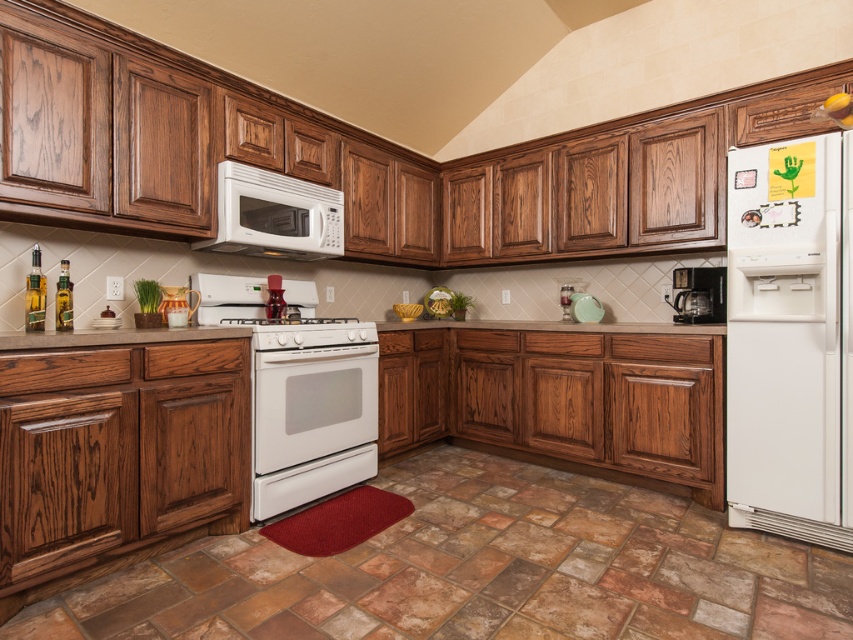
You are standing in the kitchen and want to place a new spice rack between the two points labeled point (219, 209) and point (219, 328). Based on their positions, which point should the spice rack be closer to if it needs to be placed behind the cabinets?

The spice rack should be placed closer to point (219, 209) because it is behind point (219, 328) according to the description.

You are a kitchen designer planning to install a new appliance. You need to place a new appliance between the white glossy oven at center and the white glossy microwave at upper center. Is there enough vertical space between them to fit a 15 cm tall appliance?

The white glossy oven at center is positioned under the white glossy microwave at upper center. Since the microwave is above the oven, there is vertical space between them. A 15 cm tall appliance should fit between them as long as the distance between the oven and microwave is at least 15 cm. However, the exact measurement isn

You are standing in the kitchen and want to access the white glossy microwave at upper center. However, the white glossy oven at center is blocking your view. Can you reach the microwave without moving the oven?

The white glossy oven at center is in front of the white glossy microwave at upper center, so you cannot reach the microwave without moving the oven.